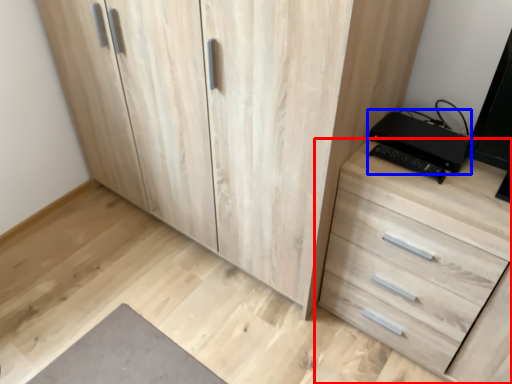
Question: Which point is closer to the camera, chest of drawers (highlighted by a red box) or computer (highlighted by a blue box)?

Choices:
 (A) chest of drawers
 (B) computer

Answer: (A)